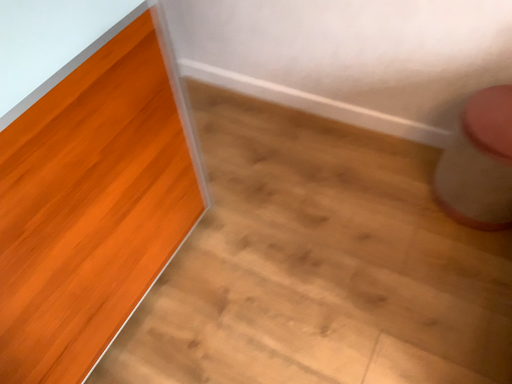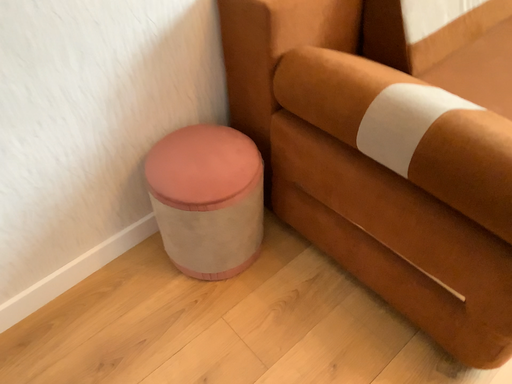
Question: How did the camera likely rotate when shooting the video?

Choices:
 (A) rotated left
 (B) rotated right

Answer: (B)